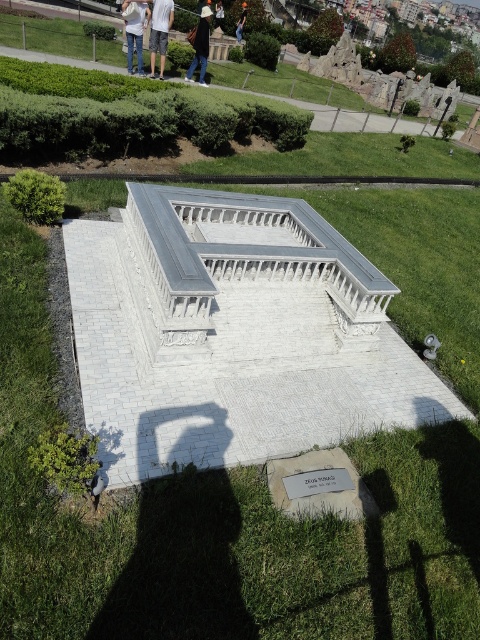
You are standing at the base of the ZEUS SUNAGI model and want to pick up both the jeans at center and the black cotton shirt at upper center. Which item is farther from your current position?

The jeans at center is 74.93 feet away from the black cotton shirt at upper center, so the black cotton shirt at upper center is closer to your current position, making the jeans at center the farther item.